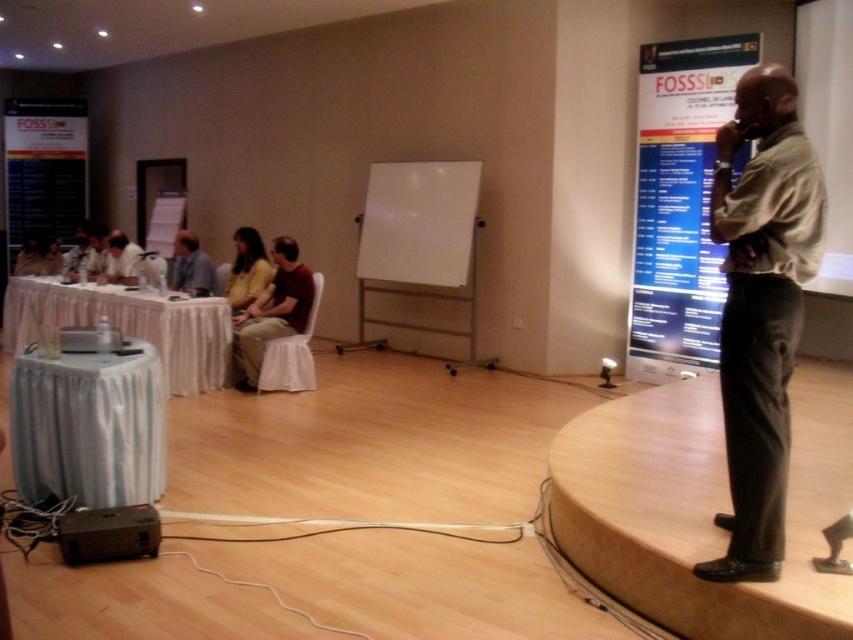
Is matte brown shirt at center below yellow fabric chair at center?

Correct, matte brown shirt at center is located below yellow fabric chair at center.

Which is more to the left, matte brown shirt at center or yellow fabric chair at center?

Positioned to the left is yellow fabric chair at center.

Is point (283, 260) farther from camera compared to point (234, 241)?

No.

Identify the location of matte brown shirt at center. (271, 310).

Does wooden table at center have a greater height compared to white draped table at left?

No, wooden table at center is not taller than white draped table at left.

Which of these two, wooden table at center or white draped table at left, stands taller?

Standing taller between the two is white draped table at left.

Between point (811, 518) and point (151, 310), which one is positioned behind?

Point (151, 310)

At what (x,y) coordinates should I click in order to perform the action: click on wooden table at center. Please return your answer as a coordinate pair (x, y). Looking at the image, I should click on (701, 508).

Between white paperboard at left and matte white chair at center, which one is positioned higher?

white paperboard at left is above.

Does white paperboard at left appear under matte white chair at center?

No.

The image size is (853, 640). What do you see at coordinates (44, 168) in the screenshot? I see `white paperboard at left` at bounding box center [44, 168].

I want to click on white paperboard at left, so click(x=44, y=168).